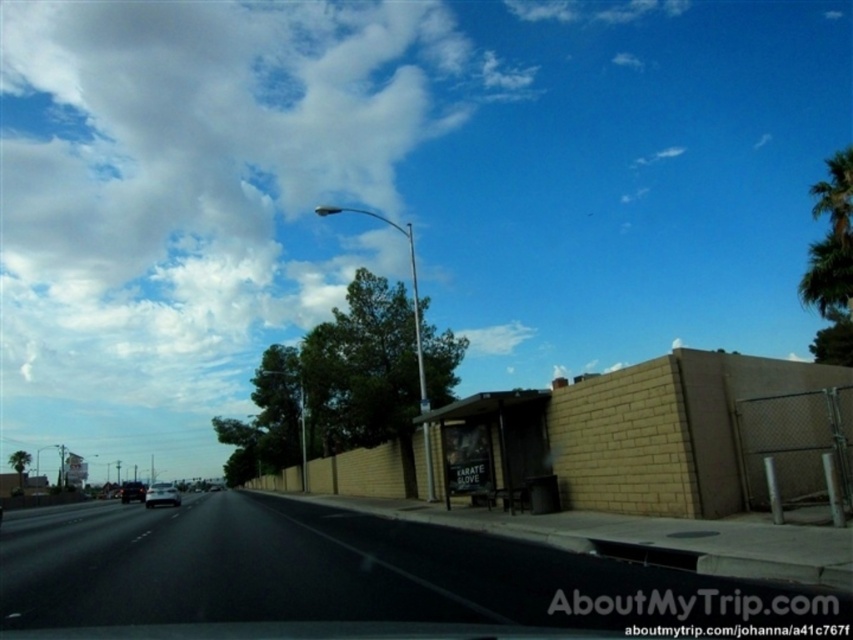
Question: Which point appears farthest from the camera in this image?

Choices:
 (A) (28, 593)
 (B) (128, 481)

Answer: (B)

Question: Does black asphalt highway at center appear on the left side of silver metallic car at center?

Choices:
 (A) yes
 (B) no

Answer: (B)

Question: Which point appears farthest from the camera in this image?

Choices:
 (A) (128, 481)
 (B) (146, 506)

Answer: (A)

Question: Which object is farther from the camera taking this photo?

Choices:
 (A) silver metallic car at center
 (B) black asphalt highway at center
 (C) silver metallic sedan at center

Answer: (C)

Question: Considering the relative positions of black asphalt highway at center and silver metallic car at center in the image provided, where is black asphalt highway at center located with respect to silver metallic car at center?

Choices:
 (A) left
 (B) right

Answer: (B)

Question: Is silver metallic car at center below silver metallic sedan at center?

Choices:
 (A) no
 (B) yes

Answer: (A)